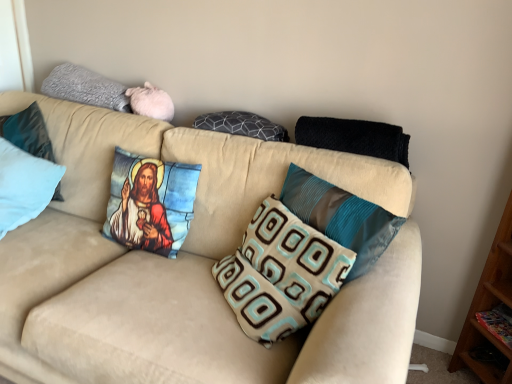
Question: Which direction should I rotate to look at printed fabric pillow with jesus image at center, positioned as the fifth pillow in right-to-left order, — up or down?

Choices:
 (A) down
 (B) up

Answer: (A)

Question: Is gray fuzzy pillow at upper left, the 6th pillow when ordered from right to left, outside light blue fabric pillow at left, the 8th pillow when ordered from right to left?

Choices:
 (A) yes
 (B) no

Answer: (A)

Question: Does gray fuzzy pillow at upper left, marked as the 3th pillow in a left-to-right arrangement, appear on the left side of light blue fabric pillow at left, the first pillow from the left?

Choices:
 (A) yes
 (B) no

Answer: (B)

Question: Does gray fuzzy pillow at upper left, the 6th pillow when ordered from right to left, have a larger size compared to light blue fabric pillow at left, the first pillow from the left?

Choices:
 (A) yes
 (B) no

Answer: (B)

Question: Is gray fuzzy pillow at upper left, the 6th pillow when ordered from right to left, positioned far away from light blue fabric pillow at left, the 8th pillow when ordered from right to left?

Choices:
 (A) yes
 (B) no

Answer: (B)

Question: Can you confirm if gray fuzzy pillow at upper left, marked as the 3th pillow in a left-to-right arrangement, is thinner than light blue fabric pillow at left, the first pillow from the left?

Choices:
 (A) yes
 (B) no

Answer: (A)

Question: From a real-world perspective, does gray fuzzy pillow at upper left, the 6th pillow when ordered from right to left, sit lower than light blue fabric pillow at left, the 8th pillow when ordered from right to left?

Choices:
 (A) no
 (B) yes

Answer: (A)

Question: Considering the relative sizes of light blue fabric pillow at left, the 8th pillow when ordered from right to left, and gray fuzzy pillow at upper left, marked as the 3th pillow in a left-to-right arrangement, in the image provided, is light blue fabric pillow at left, the 8th pillow when ordered from right to left, wider than gray fuzzy pillow at upper left, marked as the 3th pillow in a left-to-right arrangement,?

Choices:
 (A) no
 (B) yes

Answer: (B)

Question: Considering the relative positions of light blue fabric pillow at left, the 8th pillow when ordered from right to left, and gray fuzzy pillow at upper left, marked as the 3th pillow in a left-to-right arrangement, in the image provided, is light blue fabric pillow at left, the 8th pillow when ordered from right to left, to the right of gray fuzzy pillow at upper left, marked as the 3th pillow in a left-to-right arrangement, from the viewer's perspective?

Choices:
 (A) yes
 (B) no

Answer: (B)

Question: Is gray fuzzy pillow at upper left, the 6th pillow when ordered from right to left, at the back of light blue fabric pillow at left, the 8th pillow when ordered from right to left?

Choices:
 (A) yes
 (B) no

Answer: (B)

Question: From a real-world perspective, is light blue fabric pillow at left, the first pillow from the left, located beneath gray fuzzy pillow at upper left, the 6th pillow when ordered from right to left?

Choices:
 (A) yes
 (B) no

Answer: (A)

Question: Is light blue fabric pillow at left, the first pillow from the left, not within gray fuzzy pillow at upper left, marked as the 3th pillow in a left-to-right arrangement?

Choices:
 (A) no
 (B) yes

Answer: (B)

Question: Can you confirm if light blue fabric pillow at left, the 8th pillow when ordered from right to left, is bigger than gray fuzzy pillow at upper left, marked as the 3th pillow in a left-to-right arrangement?

Choices:
 (A) no
 (B) yes

Answer: (B)

Question: Is beige fabric couch at center at the right side of black knitted blanket at upper right, arranged as the 8th pillow when viewed from the left?

Choices:
 (A) yes
 (B) no

Answer: (B)